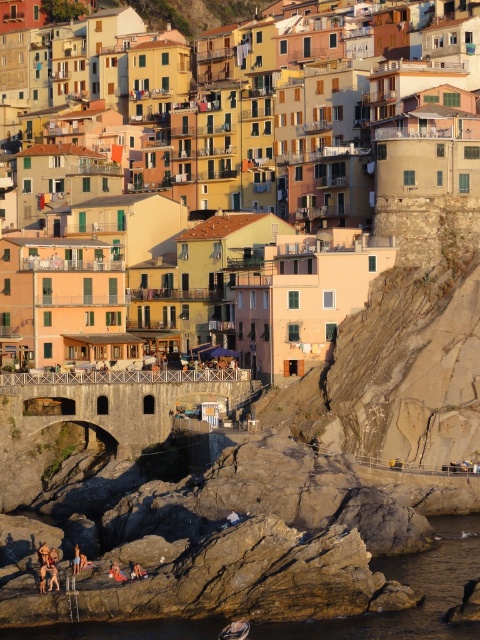
Question: Which point is closer to the camera?

Choices:
 (A) matte yellow building at center
 (B) translucent water at lower center

Answer: (B)

Question: Does matte yellow building at center have a smaller size compared to metallic gray boat at lower center?

Choices:
 (A) yes
 (B) no

Answer: (B)

Question: Which point is closer to the camera?

Choices:
 (A) metallic gray boat at lower center
 (B) matte yellow building at center
 (C) brown leather jacket at lower center

Answer: (A)

Question: Among these objects, which one is nearest to the camera?

Choices:
 (A) brown leather jacket at lower center
 (B) metallic gray boat at lower center

Answer: (B)

Question: In this image, where is matte yellow building at center located relative to metallic gray boat at lower center?

Choices:
 (A) above
 (B) below

Answer: (A)

Question: Observing the image, what is the correct spatial positioning of metallic gray boat at lower center in reference to brown leather jacket at lower center?

Choices:
 (A) below
 (B) above

Answer: (A)